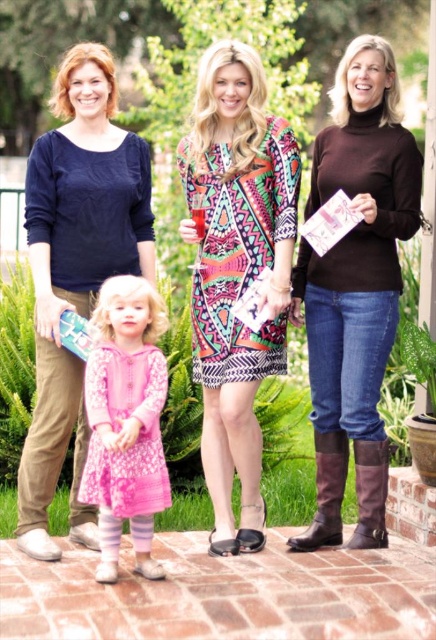
You are a photographer trying to capture a photo of the two subjects in the scene. The subjects are the matte navy blue blouse at left and the leather boots at lower right. Based on their positions, which subject is closer to the left side of the frame?

The matte navy blue blouse at left is closer to the left side of the frame because it is positioned to the left of the leather boots at lower right.

You are a fashion designer observing the scene. You need to determine which clothing item is smaller between the brown turtleneck sweater at center and the matte navy blue blouse at left. Which one should you choose for a design that requires a smaller size?

The brown turtleneck sweater at center has a smaller size compared to the matte navy blue blouse at left, so you should choose the brown turtleneck sweater at center for the design requiring a smaller size.

You are trying to decide which clothing item to wear for a casual day out. You see the brown turtleneck sweater at center and the matte navy blue blouse at left in the image. Which one is located to the right of the other?

The brown turtleneck sweater at center is positioned on the right side of the matte navy blue blouse at left.